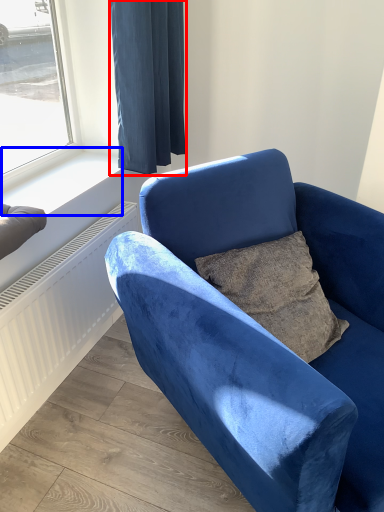
Question: Which of the following is the farthest to the observer, curtain (highlighted by a red box) or window sill (highlighted by a blue box)?

Choices:
 (A) curtain
 (B) window sill

Answer: (B)